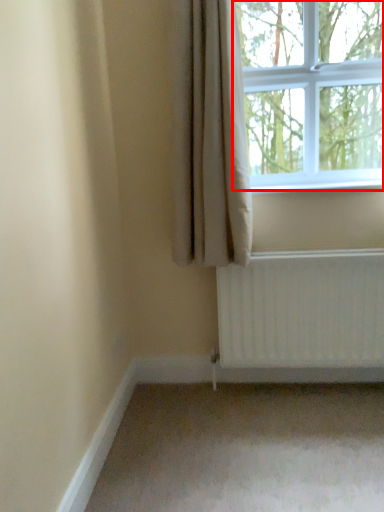
Question: From the image's perspective, where is window (annotated by the red box) located in relation to curtain in the image?

Choices:
 (A) above
 (B) below

Answer: (A)